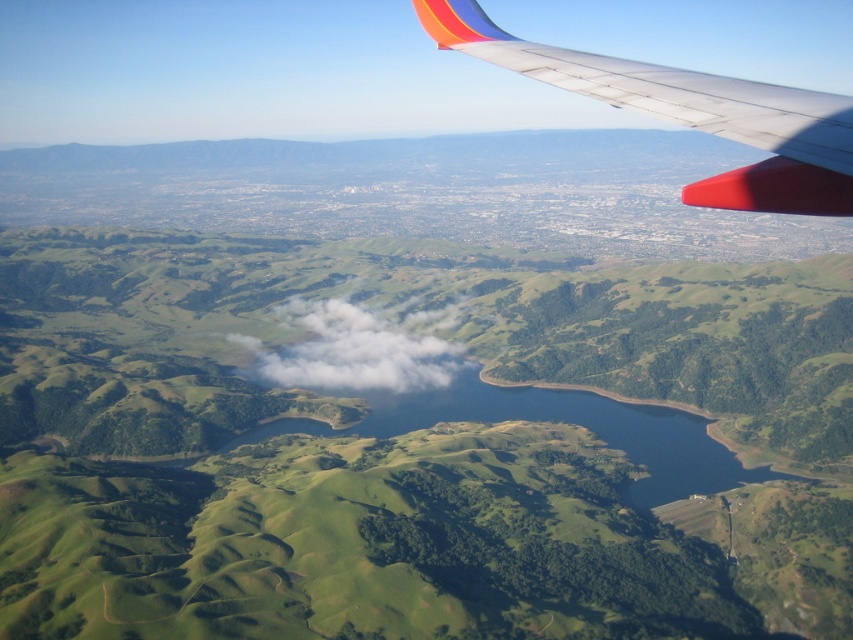
Question: Which of the following is the closest to the observer?

Choices:
 (A) (738, 182)
 (B) (428, 355)

Answer: (A)

Question: Can you confirm if metallic silver wing at upper right is thinner than white fluffy cloud at center?

Choices:
 (A) yes
 (B) no

Answer: (A)

Question: Does metallic silver wing at upper right have a greater width compared to white fluffy cloud at center?

Choices:
 (A) no
 (B) yes

Answer: (A)

Question: Which of the following is the farthest from the observer?

Choices:
 (A) green grassy hills at center
 (B) metallic silver wing at upper right

Answer: (A)

Question: Among these objects, which one is nearest to the camera?

Choices:
 (A) metallic silver wing at upper right
 (B) white fluffy cloud at center
 (C) green grassy hills at center

Answer: (A)

Question: Can you confirm if metallic silver wing at upper right is smaller than white fluffy cloud at center?

Choices:
 (A) no
 (B) yes

Answer: (B)